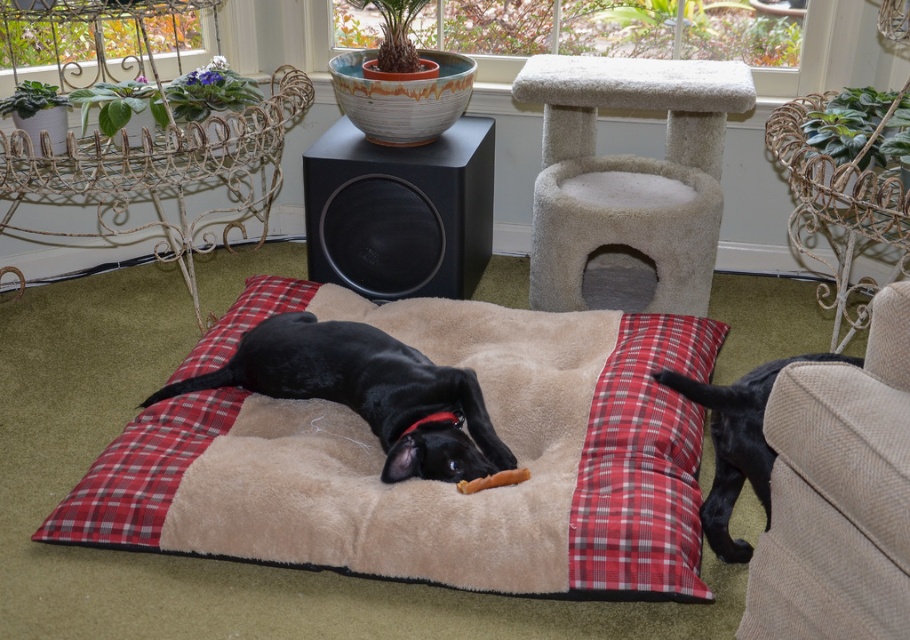
Question: Which point is farther to the camera?

Choices:
 (A) beige fleece dog bed at center
 (B) beige corduroy armchair at lower right
 (C) black matte speaker at center

Answer: (C)

Question: Is beige fleece dog bed at center positioned at the back of black fur dog at lower right?

Choices:
 (A) no
 (B) yes

Answer: (B)

Question: Which point is closer to the camera?

Choices:
 (A) (752, 592)
 (B) (656, 332)
 (C) (420, 156)

Answer: (A)

Question: Can you confirm if beige carpeted cat tree at center is wider than black matte speaker at center?

Choices:
 (A) yes
 (B) no

Answer: (A)

Question: Which point appears closest to the camera in this image?

Choices:
 (A) (460, 216)
 (B) (433, 432)
 (C) (671, 141)
 (D) (588, 513)

Answer: (D)

Question: Observing the image, what is the correct spatial positioning of red plaid pillow at lower center in reference to black soft fur dog at center?

Choices:
 (A) right
 (B) left

Answer: (A)